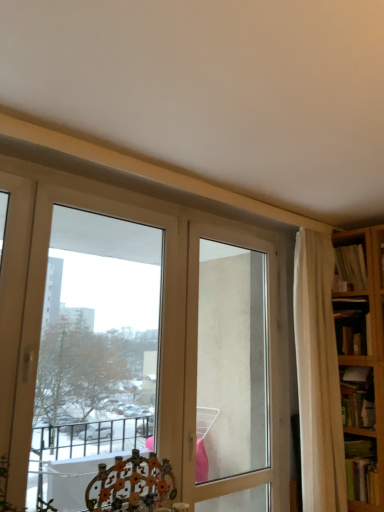
Question: Is point (370, 394) positioned closer to the camera than point (268, 369)?

Choices:
 (A) farther
 (B) closer

Answer: (B)

Question: In the image, is hardcover book at right, the 2th book from the bottom, positioned in front of or behind transparent glass screen door at center?

Choices:
 (A) behind
 (B) front

Answer: (A)

Question: Which of these objects is positioned farthest from the transparent glass screen door at center?

Choices:
 (A) hardcover book at lower right, which is the fourth book in top-to-bottom order
 (B) hardcover book at right, the 3th book when ordered from top to bottom
 (C) white fabric curtain at right
 (D) transparent glass window at upper left
 (E) hardcover book at right, which appears as the fourth book when ordered from the bottom

Answer: (D)

Question: Which object is positioned closest to the hardcover book at lower right, the first book when ordered from bottom to top?

Choices:
 (A) transparent glass screen door at center
 (B) white fabric curtain at right
 (C) transparent glass window at upper left
 (D) metallic floral chair at lower center
 (E) hardcover book at right, the 2th book from the bottom

Answer: (E)